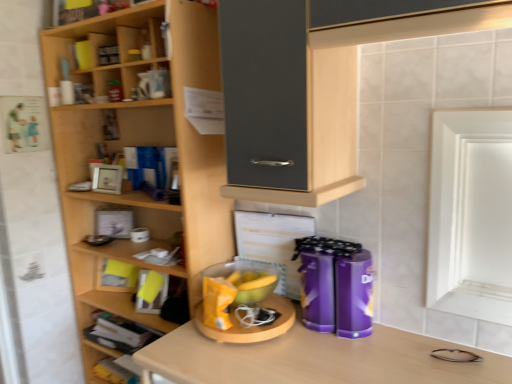
Question: Can you confirm if wooden books at lower left, the second shelf positioned from the bottom, is shorter than wooden shelves at left, the third shelf positioned from the bottom?

Choices:
 (A) yes
 (B) no

Answer: (A)

Question: Is wooden books at lower left, which ranks as the 2th shelf in top-to-bottom order, in front of wooden shelves at left, the third shelf positioned from the bottom?

Choices:
 (A) yes
 (B) no

Answer: (B)

Question: Is wooden books at lower left, which ranks as the 2th shelf in top-to-bottom order, turned away from wooden shelves at left, arranged as the 1th shelf when viewed from the top?

Choices:
 (A) yes
 (B) no

Answer: (A)

Question: From the image's perspective, is wooden books at lower left, which ranks as the 2th shelf in top-to-bottom order, located above wooden shelves at left, the third shelf positioned from the bottom?

Choices:
 (A) no
 (B) yes

Answer: (A)

Question: Is wooden books at lower left, the second shelf positioned from the bottom, smaller than wooden shelves at left, arranged as the 1th shelf when viewed from the top?

Choices:
 (A) no
 (B) yes

Answer: (B)

Question: Is wooden books at lower left, the second shelf positioned from the bottom, positioned beyond the bounds of wooden shelves at left, the third shelf positioned from the bottom?

Choices:
 (A) no
 (B) yes

Answer: (A)

Question: From a real-world perspective, is yellow matte bowl at center, the second appliance when ordered from right to left, on top of purple glossy canisters at center, placed as the second appliance when sorted from left to right?

Choices:
 (A) yes
 (B) no

Answer: (B)

Question: Is the position of yellow matte bowl at center, the 1th appliance in the left-to-right sequence, more distant than that of purple glossy canisters at center, placed as the second appliance when sorted from left to right?

Choices:
 (A) yes
 (B) no

Answer: (A)

Question: Does yellow matte bowl at center, the 1th appliance in the left-to-right sequence, lie in front of purple glossy canisters at center, arranged as the first appliance when viewed from the right?

Choices:
 (A) yes
 (B) no

Answer: (B)

Question: Can you confirm if yellow matte bowl at center, the second appliance when ordered from right to left, is smaller than purple glossy canisters at center, placed as the second appliance when sorted from left to right?

Choices:
 (A) yes
 (B) no

Answer: (A)

Question: Can you confirm if yellow matte bowl at center, the second appliance when ordered from right to left, is bigger than purple glossy canisters at center, arranged as the first appliance when viewed from the right?

Choices:
 (A) yes
 (B) no

Answer: (B)

Question: Considering the relative sizes of yellow matte bowl at center, the second appliance when ordered from right to left, and purple glossy canisters at center, placed as the second appliance when sorted from left to right, in the image provided, is yellow matte bowl at center, the second appliance when ordered from right to left, wider than purple glossy canisters at center, placed as the second appliance when sorted from left to right,?

Choices:
 (A) yes
 (B) no

Answer: (A)

Question: Can you confirm if wooden shelves at left, the third shelf positioned from the bottom, is thinner than yellow matte bowl at center, the second appliance when ordered from right to left?

Choices:
 (A) no
 (B) yes

Answer: (A)